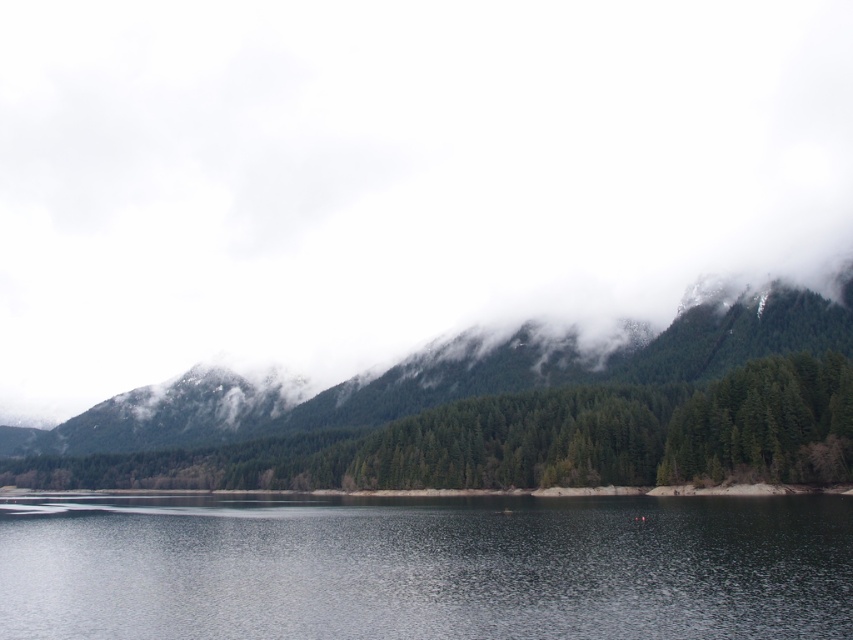
How much distance is there between white fluffy cloud at upper center and smooth dark water at center?

white fluffy cloud at upper center and smooth dark water at center are 359.63 meters apart from each other.

This screenshot has width=853, height=640. What are the coordinates of `white fluffy cloud at upper center` in the screenshot? It's located at (393, 177).

Does white fluffy cloud at upper center lie behind green matte forest at center?

Yes.

This screenshot has height=640, width=853. What do you see at coordinates (393, 177) in the screenshot?
I see `white fluffy cloud at upper center` at bounding box center [393, 177].

At what (x,y) coordinates should I click in order to perform the action: click on white fluffy cloud at upper center. Please return your answer as a coordinate pair (x, y). The height and width of the screenshot is (640, 853). Looking at the image, I should click on (393, 177).

Between point (103, 608) and point (621, 413), which one is positioned in front?

Point (103, 608)

What do you see at coordinates (425, 566) in the screenshot? This screenshot has height=640, width=853. I see `smooth dark water at center` at bounding box center [425, 566].

Is point (154, 532) less distant than point (171, 426)?

Yes.

Where is `smooth dark water at center`? smooth dark water at center is located at coordinates (425, 566).